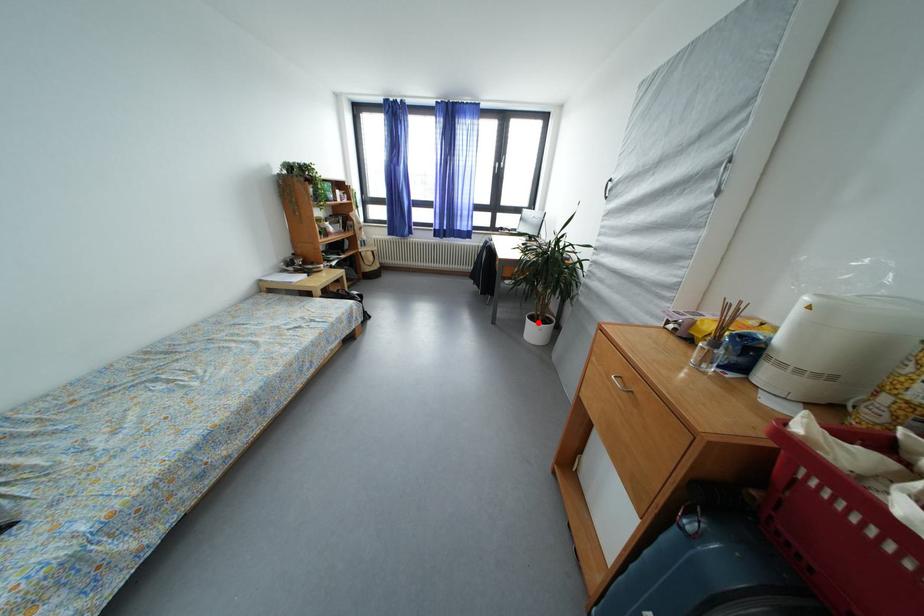
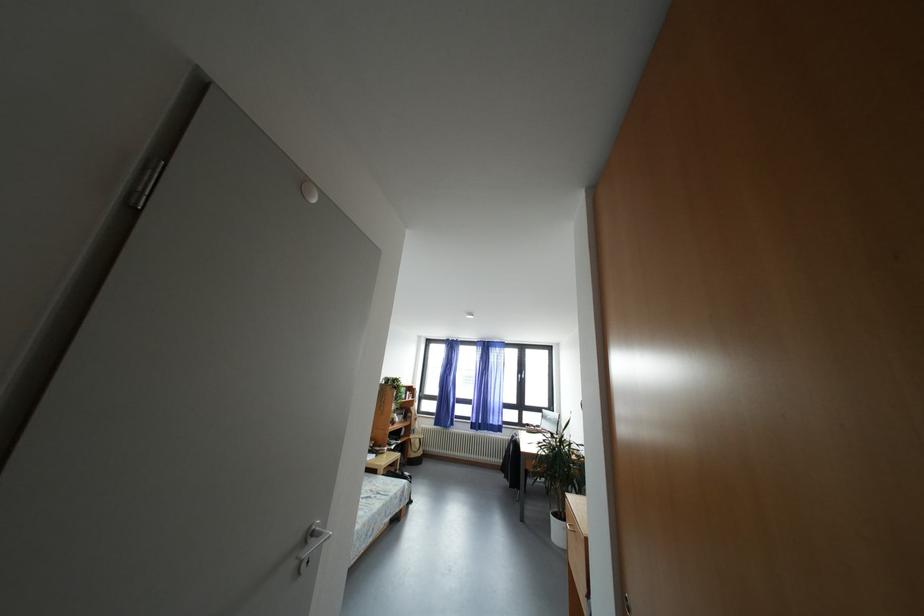
Question: I am providing you with two images of the same scene from different viewpoints. In image1, a red point is highlighted. Considering the same 3D point in image2, which of the following is correct?

Choices:
 (A) It is closer
 (B) It is farther

Answer: (B)